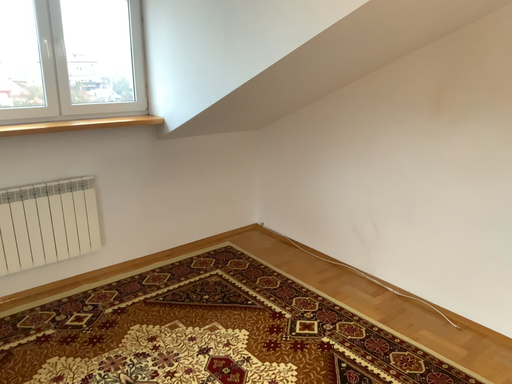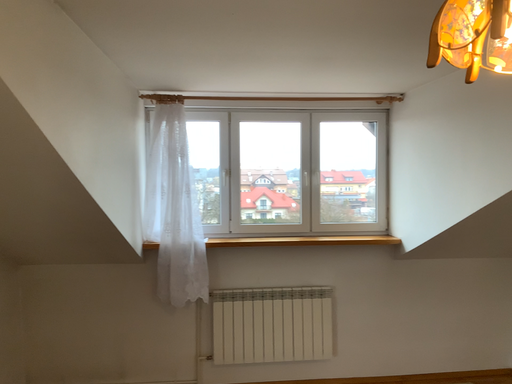
Question: How did the camera likely rotate when shooting the video?

Choices:
 (A) rotated upward
 (B) rotated downward

Answer: (A)